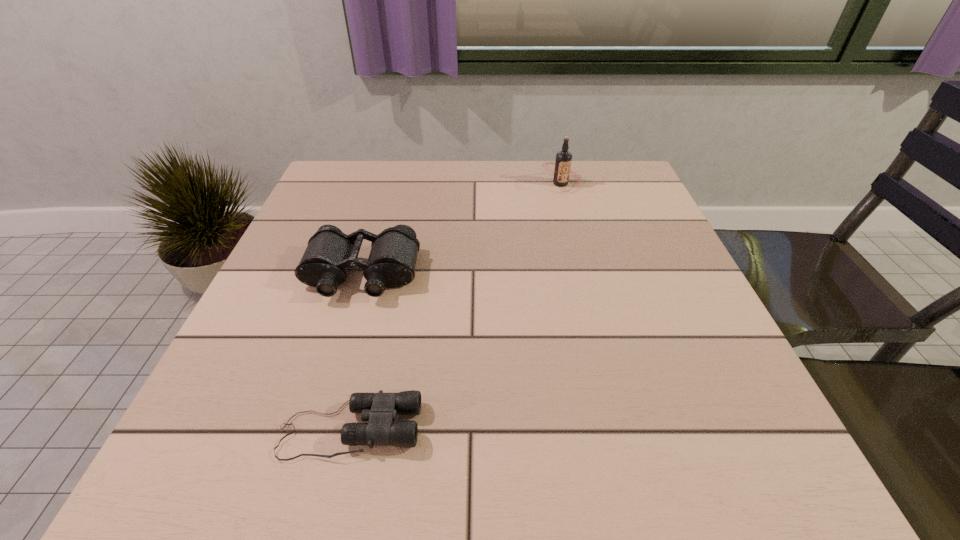
Locate an element on the screen. The width and height of the screenshot is (960, 540). free spot at the near right corner of the desktop is located at coordinates (762, 473).

Identify the location of free point between the root beer and the farther binoculars. The width and height of the screenshot is (960, 540). (462, 229).

Where is `unoccupied position between the farthest object and the second tallest object`? The image size is (960, 540). unoccupied position between the farthest object and the second tallest object is located at coordinates (462, 229).

You are a GUI agent. You are given a task and a screenshot of the screen. Output one action in this format:
    pyautogui.click(x=<x>, y=<y>)
    Task: Click on the free space that is in between the tallest object and the second farthest object
    
    Given the screenshot: What is the action you would take?
    pyautogui.click(x=462, y=229)

Where is `free spot between the tallest object and the nearer binoculars`? free spot between the tallest object and the nearer binoculars is located at coordinates (455, 306).

The height and width of the screenshot is (540, 960). I want to click on unoccupied position between the root beer and the second tallest object, so click(x=462, y=229).

This screenshot has height=540, width=960. What are the coordinates of `free spot between the nearer binoculars and the second farthest object` in the screenshot? It's located at (356, 352).

The height and width of the screenshot is (540, 960). I want to click on blank region between the shorter binoculars and the root beer, so click(x=455, y=306).

Locate an element on the screen. The height and width of the screenshot is (540, 960). free area in between the tallest object and the shorter binoculars is located at coordinates (455, 306).

The image size is (960, 540). I want to click on free point between the tallest object and the second shortest object, so click(x=462, y=229).